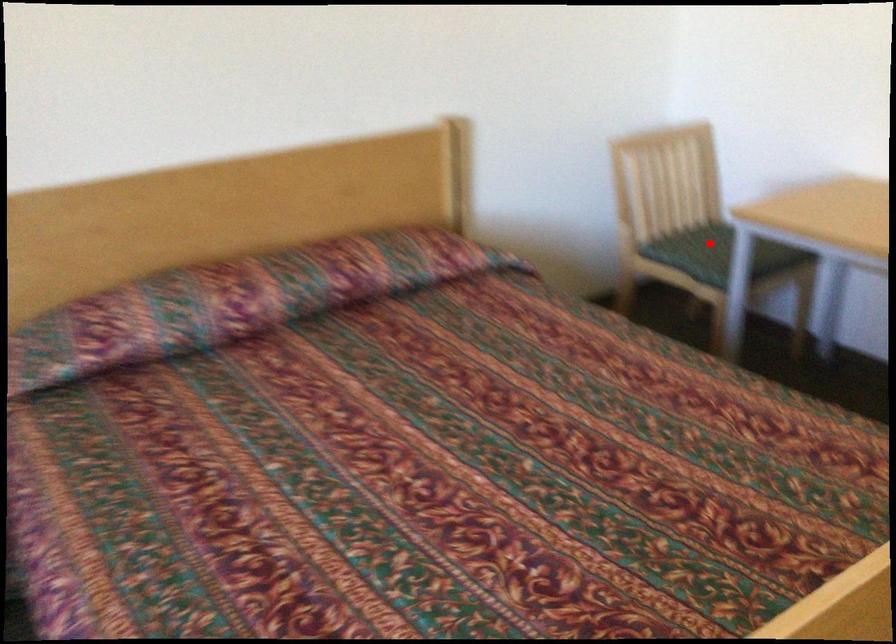
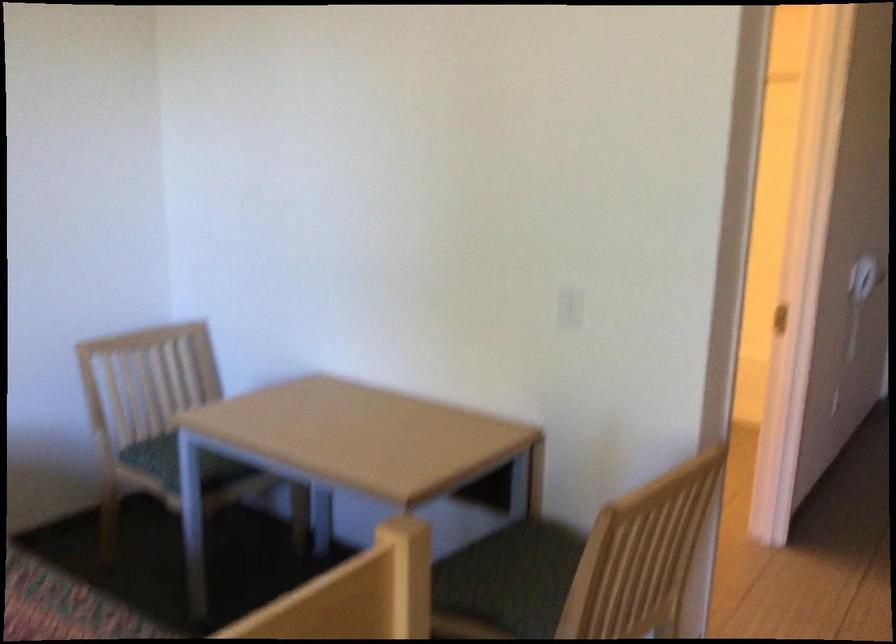
Question: I am providing you with two images of the same scene from different viewpoints. A red point is marked on the first image. Can you still see the location of the red point in image 2?

Choices:
 (A) Yes
 (B) No

Answer: (B)